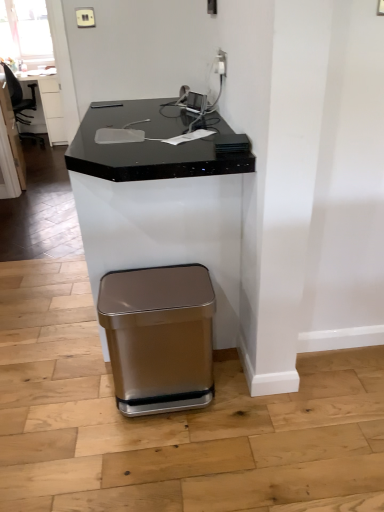
What is the approximate width of satin gold trash can at lower center?

It is 44.64 centimeters.

You are a GUI agent. You are given a task and a screenshot of the screen. Output one action in this format:
    pyautogui.click(x=<x>, y=<y>)
    Task: Click on the black granite desk at center
    The width and height of the screenshot is (384, 512).
    Given the screenshot: What is the action you would take?
    pyautogui.click(x=162, y=198)

Find the location of a particular element. This screenshot has width=384, height=512. satin gold trash can at lower center is located at coordinates (159, 337).

Does black granite desk at center have a greater height compared to satin gold trash can at lower center?

Yes, black granite desk at center is taller than satin gold trash can at lower center.

Find the location of `desk located on the left of satin gold trash can at lower center`. desk located on the left of satin gold trash can at lower center is located at coordinates (162, 198).

Considering the relative positions of black granite desk at center and satin gold trash can at lower center in the image provided, is black granite desk at center to the left or to the right of satin gold trash can at lower center?

Clearly, black granite desk at center is on the left of satin gold trash can at lower center in the image.

From the image's perspective, would you say black granite desk at center is shown under satin gold trash can at lower center?

Actually, black granite desk at center appears above satin gold trash can at lower center in the image.

From the picture: Which is more distant, (x=102, y=173) or (x=218, y=64)?

The point (x=218, y=64) is behind.

Is black granite desk at center not inside satin gold outlet at upper center?

black granite desk at center is positioned outside satin gold outlet at upper center.

From the image's perspective, is black granite desk at center over satin gold outlet at upper center?

No, from the image's perspective, black granite desk at center is not over satin gold outlet at upper center.

Considering the relative positions of black granite table at upper left and satin gold trash can at lower center in the image provided, is black granite table at upper left to the left or to the right of satin gold trash can at lower center?

black granite table at upper left is to the left of satin gold trash can at lower center.

Relative to satin gold trash can at lower center, is black granite table at upper left in front or behind?

In the image, black granite table at upper left appears behind satin gold trash can at lower center.

Which of these two, black granite table at upper left or satin gold trash can at lower center, is bigger?

Bigger between the two is black granite table at upper left.

Which of these two, black granite table at upper left or satin gold trash can at lower center, is wider?

Wider between the two is black granite table at upper left.

Considering the sizes of objects black granite table at upper left and black leather swivel chair at left in the image provided, who is thinner, black granite table at upper left or black leather swivel chair at left?

With smaller width is black leather swivel chair at left.

Can we say black granite table at upper left lies outside black leather swivel chair at left?

black granite table at upper left is positioned outside black leather swivel chair at left.

From the image's perspective, is black granite table at upper left on black leather swivel chair at left?

Yes, from the image's perspective, black granite table at upper left is above black leather swivel chair at left.

Can you tell me how much black granite table at upper left and black leather swivel chair at left differ in facing direction?

85.7 degrees.

From the image's perspective, between satin gold outlet at upper center and satin gold trash can at lower center, which one is located above?

satin gold outlet at upper center, from the image's perspective.

Between satin gold outlet at upper center and satin gold trash can at lower center, which one has smaller size?

satin gold outlet at upper center.

From a real-world perspective, which is physically below, satin gold outlet at upper center or satin gold trash can at lower center?

satin gold trash can at lower center, from a real-world perspective.

Considering the relative sizes of satin gold outlet at upper center and black granite table at upper left in the image provided, is satin gold outlet at upper center smaller than black granite table at upper left?

Yes.

Does satin gold outlet at upper center have a lesser height compared to black granite table at upper left?

Indeed, satin gold outlet at upper center has a lesser height compared to black granite table at upper left.

Consider the image. From the image's perspective, is satin gold outlet at upper center positioned above or below black granite table at upper left?

Based on their image positions, satin gold outlet at upper center is located beneath black granite table at upper left.

Choose the correct answer: Is black leather swivel chair at left inside black granite table at upper left or outside it?

black leather swivel chair at left lies outside black granite table at upper left.

Consider the image. Considering the relative sizes of black leather swivel chair at left and black granite table at upper left in the image provided, is black leather swivel chair at left thinner than black granite table at upper left?

Correct, the width of black leather swivel chair at left is less than that of black granite table at upper left.

From the image's perspective, which one is positioned lower, black leather swivel chair at left or black granite table at upper left?

From the image's view, black leather swivel chair at left is below.

Is point (38, 137) positioned in front of point (42, 78)?

Yes.

Where is `waste container below the black granite desk at center (from a real-world perspective)`? waste container below the black granite desk at center (from a real-world perspective) is located at coordinates (159, 337).

You are a GUI agent. You are given a task and a screenshot of the screen. Output one action in this format:
    pyautogui.click(x=<x>, y=<y>)
    Task: Click on the desk on the left of satin gold outlet at upper center
    This screenshot has width=384, height=512.
    Given the screenshot: What is the action you would take?
    pyautogui.click(x=162, y=198)

Looking at the image, which one is located closer to black leather swivel chair at left, satin gold outlet at upper center or black granite table at upper left?

The object closer to black leather swivel chair at left is black granite table at upper left.

From the image, which object appears to be nearer to satin gold trash can at lower center, black granite table at upper left or black granite desk at center?

black granite desk at center.

Looking at the image, which one is located further to black granite desk at center, black leather swivel chair at left or satin gold outlet at upper center?

black leather swivel chair at left is positioned further to the anchor black granite desk at center.

Based on their spatial positions, is satin gold outlet at upper center or satin gold trash can at lower center closer to black granite table at upper left?

satin gold trash can at lower center.

When comparing their distances from satin gold outlet at upper center, does black leather swivel chair at left or black granite desk at center seem closer?

black granite desk at center is positioned closer to the anchor satin gold outlet at upper center.

Which object lies further to the anchor point black leather swivel chair at left, satin gold outlet at upper center or satin gold trash can at lower center?

Based on the image, satin gold outlet at upper center appears to be further to black leather swivel chair at left.

Which object lies nearer to the anchor point black granite table at upper left, black granite desk at center or satin gold outlet at upper center?

The object closer to black granite table at upper left is black granite desk at center.

Considering their positions, is satin gold outlet at upper center positioned closer to black leather swivel chair at left than black granite desk at center?

The object closer to black leather swivel chair at left is black granite desk at center.

The height and width of the screenshot is (512, 384). I want to click on waste container between black granite desk at center and black granite table at upper left from front to back, so click(x=159, y=337).

This screenshot has width=384, height=512. In order to click on desk that lies between satin gold outlet at upper center and satin gold trash can at lower center from top to bottom in this screenshot , I will do `click(162, 198)`.

At what (x,y) coordinates should I click in order to perform the action: click on swivel chair positioned between satin gold trash can at lower center and black granite table at upper left from near to far. Please return your answer as a coordinate pair (x, y). This screenshot has width=384, height=512. Looking at the image, I should click on (19, 97).

Where is `electric outlet located between satin gold trash can at lower center and black leather swivel chair at left in the depth direction`? electric outlet located between satin gold trash can at lower center and black leather swivel chair at left in the depth direction is located at coordinates (220, 63).